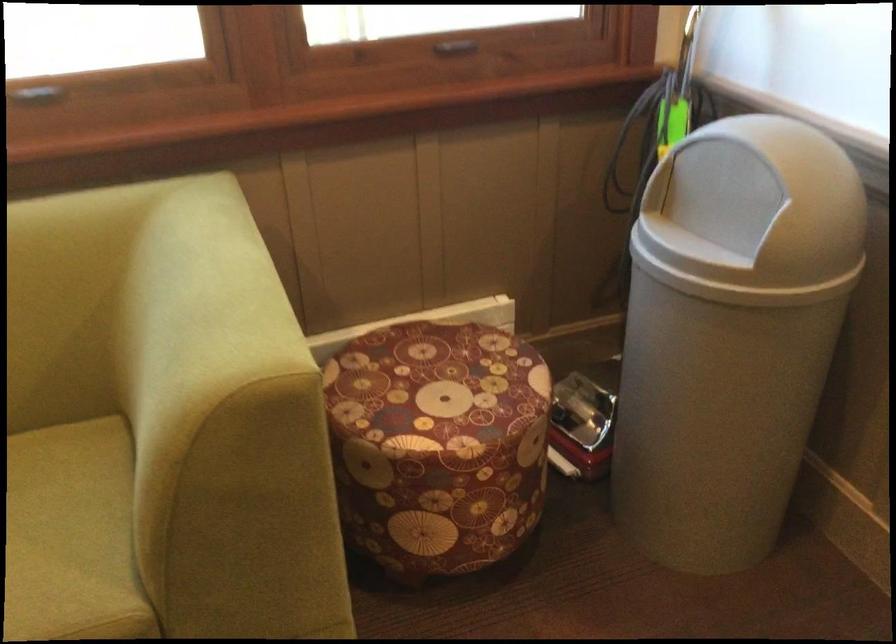
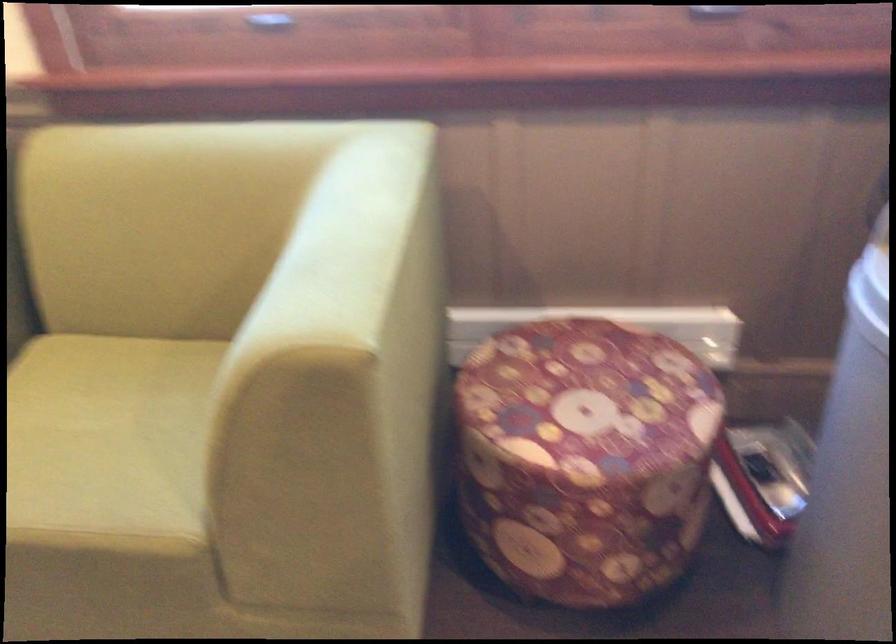
Question: The camera is either moving clockwise (left) or counter-clockwise (right) around the object. The first image is from the beginning of the video and the second image is from the end. Is the camera moving left or right when shooting the video?

Choices:
 (A) Left
 (B) Right

Answer: (B)